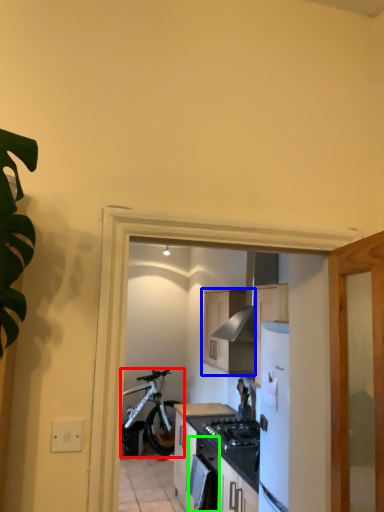
Question: Considering the real-world distances, which object is closest to bicycle (highlighted by a red box)? cabinetry (highlighted by a blue box) or oven (highlighted by a green box).

Choices:
 (A) cabinetry
 (B) oven

Answer: (A)